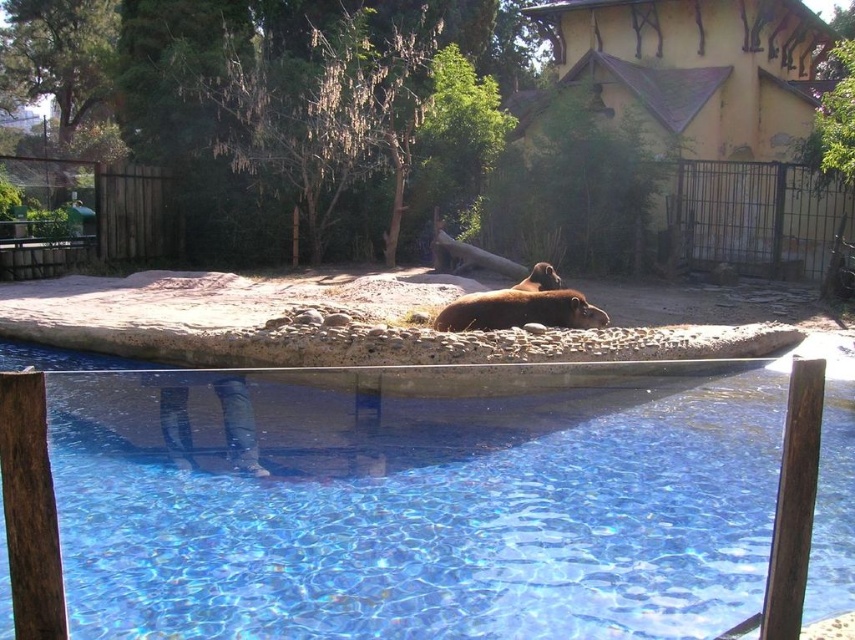
Question: In this image, where is transparent glass swimming pool at center located relative to brown fur bear at center?

Choices:
 (A) right
 (B) left

Answer: (B)

Question: Considering the relative positions of transparent glass swimming pool at center and brown fur bear at center in the image provided, where is transparent glass swimming pool at center located with respect to brown fur bear at center?

Choices:
 (A) above
 (B) below

Answer: (B)

Question: Is the position of transparent glass swimming pool at center more distant than that of brown fur bear at center?

Choices:
 (A) no
 (B) yes

Answer: (A)

Question: Which point appears farthest from the camera in this image?

Choices:
 (A) (582, 314)
 (B) (547, 493)

Answer: (A)

Question: Which object is farther from the camera taking this photo?

Choices:
 (A) brown fur bear at center
 (B) transparent glass swimming pool at center

Answer: (A)